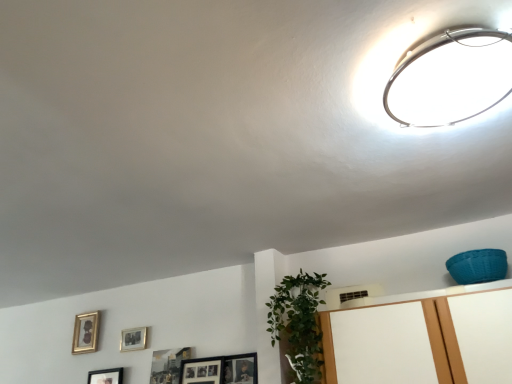
What is the approximate height of matte silver picture frame at upper center, which is the third picture frame from left to right?

It is 4.26 inches.

Identify the location of metallic silver picture frame at lower center, which ranks as the 4th picture frame in left-to-right order. This screenshot has height=384, width=512. (168, 365).

In the scene shown: Is metallic silver picture frame at lower center, which ranks as the 4th picture frame in left-to-right order, looking in the opposite direction of gold metallic picture frame at lower left, the 4th picture frame in the right-to-left sequence?

That's not correct — metallic silver picture frame at lower center, which ranks as the 4th picture frame in left-to-right order, is not looking away from gold metallic picture frame at lower left, the 4th picture frame in the right-to-left sequence.

Does point (182, 351) come farther from viewer compared to point (96, 347)?

No, (182, 351) is closer to viewer.

From a real-world perspective, which object rests below the other?

metallic silver picture frame at lower center, which is the first picture frame in right-to-left order.

Relative to green leafy plant at lower center, is metallic ring light at upper right in front or behind?

metallic ring light at upper right is in front of green leafy plant at lower center.

Who is taller, metallic ring light at upper right or green leafy plant at lower center?

green leafy plant at lower center.

Is metallic ring light at upper right wider than green leafy plant at lower center?

Indeed, metallic ring light at upper right has a greater width compared to green leafy plant at lower center.

Between point (418, 101) and point (322, 351), which one is positioned in front?

The point (418, 101) is more forward.

From a real-world perspective, which is physically above, gold metallic picture frame at lower left, which is the 1th picture frame from left to right, or green leafy plant at lower center?

In real-world perspective, gold metallic picture frame at lower left, which is the 1th picture frame from left to right, is above.

From the image's perspective, which is below, gold metallic picture frame at lower left, the 4th picture frame in the right-to-left sequence, or green leafy plant at lower center?

gold metallic picture frame at lower left, the 4th picture frame in the right-to-left sequence, from the image's perspective.

Would you say gold metallic picture frame at lower left, the 4th picture frame in the right-to-left sequence, is outside green leafy plant at lower center?

gold metallic picture frame at lower left, the 4th picture frame in the right-to-left sequence, is positioned outside green leafy plant at lower center.

Which of these two, gold metallic picture frame at lower left, the 4th picture frame in the right-to-left sequence, or green leafy plant at lower center, stands taller?

green leafy plant at lower center is taller.

Can you tell me how much black glossy picture frame at lower left, which appears as the second picture frame when viewed from the left, and gold metallic picture frame at lower left, the 4th picture frame in the right-to-left sequence, differ in facing direction?

The facing directions of black glossy picture frame at lower left, which appears as the second picture frame when viewed from the left, and gold metallic picture frame at lower left, the 4th picture frame in the right-to-left sequence, are 0.0058 degrees apart.

Between black glossy picture frame at lower left, which appears as the second picture frame when viewed from the left, and gold metallic picture frame at lower left, which is the 1th picture frame from left to right, which one appears on the left side from the viewer's perspective?

Positioned to the left is gold metallic picture frame at lower left, which is the 1th picture frame from left to right.

Consider the image. Considering the sizes of black glossy picture frame at lower left, which appears as the second picture frame when viewed from the left, and gold metallic picture frame at lower left, which is the 1th picture frame from left to right, in the image, is black glossy picture frame at lower left, which appears as the second picture frame when viewed from the left, taller or shorter than gold metallic picture frame at lower left, which is the 1th picture frame from left to right,?

Considering their sizes, black glossy picture frame at lower left, which appears as the second picture frame when viewed from the left, has less height than gold metallic picture frame at lower left, which is the 1th picture frame from left to right.

Does point (111, 372) appear closer or farther from the camera than point (98, 324)?

Point (111, 372).

How many degrees apart are the facing directions of matte silver picture frame at upper center, which is the third picture frame from left to right, and metallic silver picture frame at lower center, which is the first picture frame in right-to-left order?

The angle between the facing direction of matte silver picture frame at upper center, which is the third picture frame from left to right, and the facing direction of metallic silver picture frame at lower center, which is the first picture frame in right-to-left order, is 2.91 degrees.

Considering the sizes of matte silver picture frame at upper center, which appears as the second picture frame when viewed from the right, and metallic silver picture frame at lower center, which is the first picture frame in right-to-left order, in the image, is matte silver picture frame at upper center, which appears as the second picture frame when viewed from the right, taller or shorter than metallic silver picture frame at lower center, which is the first picture frame in right-to-left order,?

matte silver picture frame at upper center, which appears as the second picture frame when viewed from the right, is shorter than metallic silver picture frame at lower center, which is the first picture frame in right-to-left order.

Considering the relative positions of matte silver picture frame at upper center, which is the third picture frame from left to right, and metallic silver picture frame at lower center, which ranks as the 4th picture frame in left-to-right order, in the image provided, is matte silver picture frame at upper center, which is the third picture frame from left to right, in front of metallic silver picture frame at lower center, which ranks as the 4th picture frame in left-to-right order,?

No, matte silver picture frame at upper center, which is the third picture frame from left to right, is further to the viewer.

Starting from the metallic silver picture frame at lower center, which ranks as the 4th picture frame in left-to-right order, which picture frame is the 1st one to the left? Please provide its 2D coordinates.

[(133, 339)]

Is metallic ring light at upper right far from black glossy picture frame at lower left, which appears as the second picture frame when viewed from the left?

metallic ring light at upper right is far away from black glossy picture frame at lower left, which appears as the second picture frame when viewed from the left.

From a real-world perspective, count 4th picture frames downward from the metallic ring light at upper right and point to it. Please provide its 2D coordinates.

[(106, 376)]

Is metallic ring light at upper right further to camera compared to black glossy picture frame at lower left, which ranks as the 3th picture frame in right-to-left order?

No.

Between metallic ring light at upper right and black glossy picture frame at lower left, which appears as the second picture frame when viewed from the left, which one has larger width?

With larger width is metallic ring light at upper right.

Is metallic silver picture frame at lower center, which ranks as the 4th picture frame in left-to-right order, positioned with its back to green leafy plant at lower center?

No, metallic silver picture frame at lower center, which ranks as the 4th picture frame in left-to-right order, is not facing away from green leafy plant at lower center.

Looking at this image, which object is positioned more to the right, metallic silver picture frame at lower center, which is the first picture frame in right-to-left order, or green leafy plant at lower center?

green leafy plant at lower center is more to the right.

Does metallic silver picture frame at lower center, which ranks as the 4th picture frame in left-to-right order, have a smaller size compared to green leafy plant at lower center?

Yes.

Which picture frame is the 3rd one when counting from the left side of the metallic silver picture frame at lower center, which is the first picture frame in right-to-left order? Please provide its 2D coordinates.

[(85, 333)]

Locate an element on the screen. This screenshot has height=384, width=512. lamp above the green leafy plant at lower center (from the image's perspective) is located at coordinates (450, 78).

When comparing their distances from black glossy picture frame at lower left, which appears as the second picture frame when viewed from the left, does metallic silver picture frame at lower center, which is the first picture frame in right-to-left order, or metallic ring light at upper right seem further?

metallic ring light at upper right.

Which object lies nearer to the anchor point metallic silver picture frame at lower center, which is the first picture frame in right-to-left order, gold metallic picture frame at lower left, the 4th picture frame in the right-to-left sequence, or green leafy plant at lower center?

gold metallic picture frame at lower left, the 4th picture frame in the right-to-left sequence, is positioned closer to the anchor metallic silver picture frame at lower center, which is the first picture frame in right-to-left order.

Estimate the real-world distances between objects in this image. Which object is closer to black glossy picture frame at lower left, which ranks as the 3th picture frame in right-to-left order, gold metallic picture frame at lower left, the 4th picture frame in the right-to-left sequence, or metallic ring light at upper right?

gold metallic picture frame at lower left, the 4th picture frame in the right-to-left sequence, is closer to black glossy picture frame at lower left, which ranks as the 3th picture frame in right-to-left order.

In the scene shown: Estimate the real-world distances between objects in this image. Which object is closer to black glossy picture frame at lower left, which appears as the second picture frame when viewed from the left, green leafy plant at lower center or gold metallic picture frame at lower left, which is the 1th picture frame from left to right?

gold metallic picture frame at lower left, which is the 1th picture frame from left to right, is closer to black glossy picture frame at lower left, which appears as the second picture frame when viewed from the left.

Considering their positions, is matte silver picture frame at upper center, which appears as the second picture frame when viewed from the right, positioned further to metallic silver picture frame at lower center, which is the first picture frame in right-to-left order, than gold metallic picture frame at lower left, which is the 1th picture frame from left to right?

Among the two, gold metallic picture frame at lower left, which is the 1th picture frame from left to right, is located further to metallic silver picture frame at lower center, which is the first picture frame in right-to-left order.

From the image, which object appears to be farther from metallic ring light at upper right, metallic silver picture frame at lower center, which is the first picture frame in right-to-left order, or matte silver picture frame at upper center, which appears as the second picture frame when viewed from the right?

matte silver picture frame at upper center, which appears as the second picture frame when viewed from the right, is further to metallic ring light at upper right.

From the image, which object appears to be farther from green leafy plant at lower center, matte silver picture frame at upper center, which appears as the second picture frame when viewed from the right, or black glossy picture frame at lower left, which appears as the second picture frame when viewed from the left?

black glossy picture frame at lower left, which appears as the second picture frame when viewed from the left, is further to green leafy plant at lower center.

Based on their spatial positions, is metallic ring light at upper right or metallic silver picture frame at lower center, which ranks as the 4th picture frame in left-to-right order, closer to green leafy plant at lower center?

metallic silver picture frame at lower center, which ranks as the 4th picture frame in left-to-right order.

Find the location of a particular element. The image size is (512, 384). picture frame between matte silver picture frame at upper center, which is the third picture frame from left to right, and green leafy plant at lower center from left to right is located at coordinates (168, 365).

I want to click on houseplant between metallic ring light at upper right and metallic silver picture frame at lower center, which ranks as the 4th picture frame in left-to-right order, in the front-back direction, so click(x=298, y=323).

At what (x,y) coordinates should I click in order to perform the action: click on houseplant between metallic ring light at upper right and black glossy picture frame at lower left, which ranks as the 3th picture frame in right-to-left order, from front to back. Please return your answer as a coordinate pair (x, y). The image size is (512, 384). Looking at the image, I should click on (298, 323).

Where is `picture frame positioned between metallic ring light at upper right and black glossy picture frame at lower left, which ranks as the 3th picture frame in right-to-left order, from near to far`? Image resolution: width=512 pixels, height=384 pixels. picture frame positioned between metallic ring light at upper right and black glossy picture frame at lower left, which ranks as the 3th picture frame in right-to-left order, from near to far is located at coordinates (168, 365).